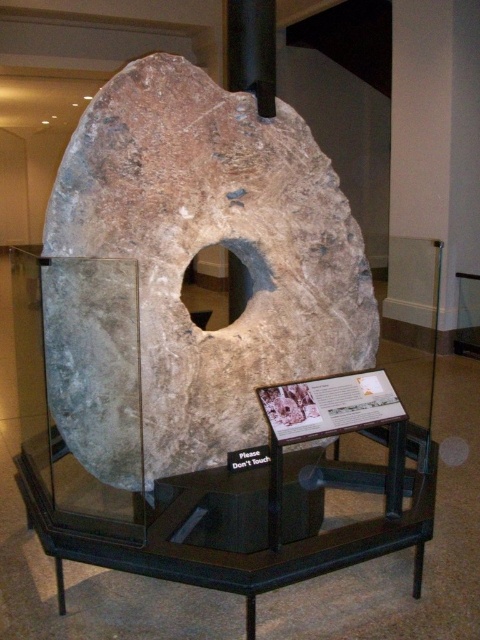
Question: Among these points, which one is nearest to the camera?

Choices:
 (A) (182, 330)
 (B) (237, 300)

Answer: (A)

Question: Does speckled stone disk at center lie in front of brown rough stone hole at center?

Choices:
 (A) yes
 (B) no

Answer: (A)

Question: Does speckled stone disk at center have a larger size compared to brown rough stone hole at center?

Choices:
 (A) yes
 (B) no

Answer: (B)

Question: Is speckled stone disk at center above brown rough stone hole at center?

Choices:
 (A) no
 (B) yes

Answer: (A)

Question: Which of the following is the farthest from the observer?

Choices:
 (A) speckled stone disk at center
 (B) brown rough stone hole at center

Answer: (B)